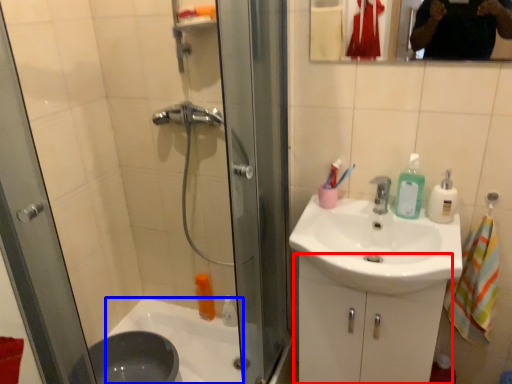
Question: Which of the following is the farthest to the observer, bathroom cabinet (highlighted by a red box) or bath (highlighted by a blue box)?

Choices:
 (A) bathroom cabinet
 (B) bath

Answer: (B)